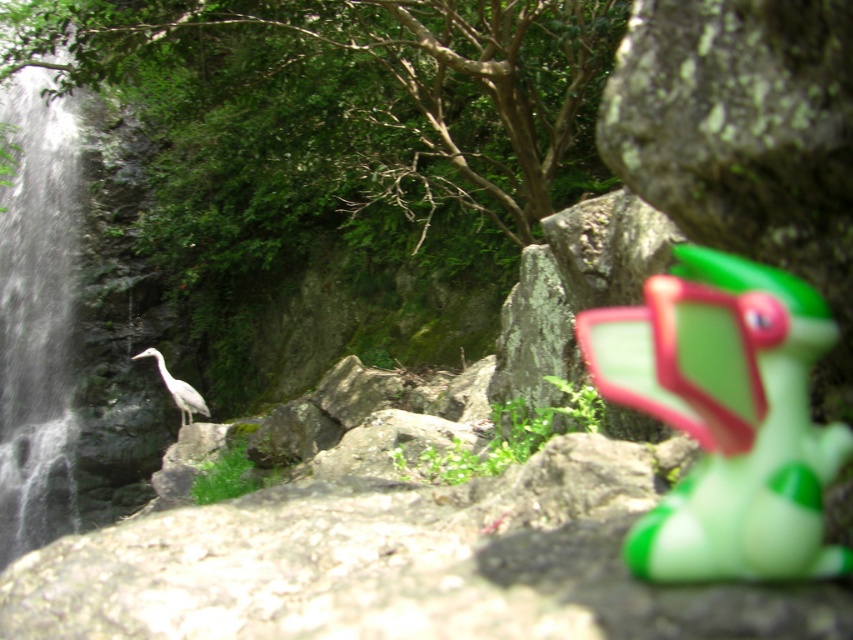
You are a dog owner trying to fetch your dog a toy. You see a green rubber toy at right and a gray matte bird at center. Which object is narrower?

The green rubber toy at right is narrower than the gray matte bird at center.

You are a hiker who wants to place a small flag between the green rubber toy at right and the gray matte bird at center. Which object should you place the flag closer to if you want it to be closer to the taller object?

The gray matte bird at center is taller than the green rubber toy at right, so you should place the flag closer to the gray matte bird at center.

You are a hiker who wants to place a small compass on the rock formation where the gray matte bird at center is standing. The compass requires a flat surface. Can you determine if the green rubber toy at right is in the way?

The green rubber toy at right is positioned on the right side of gray matte bird at center. Since the compass needs to be placed where the bird is, the toy is on the right side of that spot, so it might not directly block the placement unless it extends into the area. However, without knowing the exact size and spread of the toy, it is uncertain. But based on the given information, the toy is to the right, so the immediate area under the bird might still be accessible.